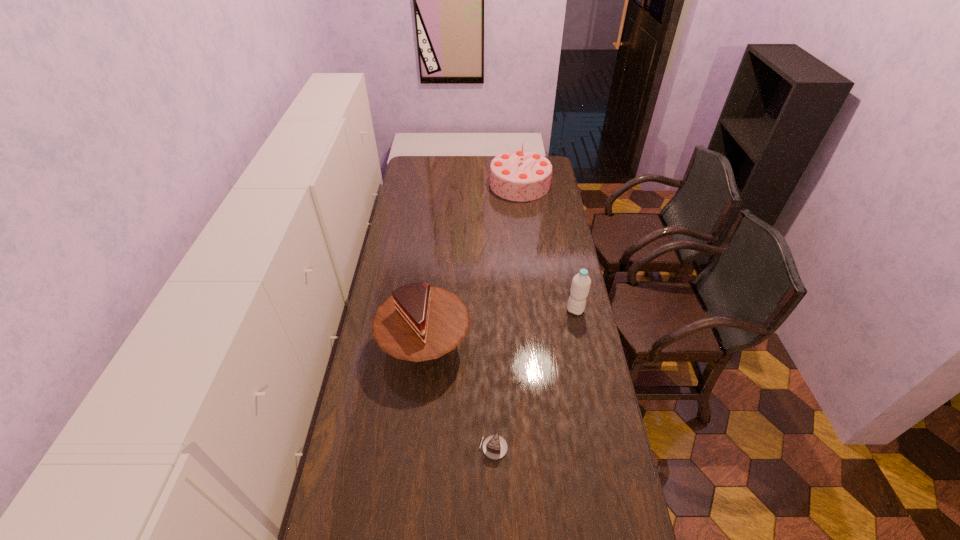
I want to click on object that is at the left edge, so click(418, 322).

This screenshot has height=540, width=960. In order to click on birthday cake positioned at the right edge in this screenshot , I will do `click(519, 175)`.

Where is `water bottle that is at the right edge`? water bottle that is at the right edge is located at coordinates (581, 282).

The height and width of the screenshot is (540, 960). Find the location of `object at the far right corner`. object at the far right corner is located at coordinates (519, 175).

In the image, there is a desktop. Where is `free space at the left edge`? The image size is (960, 540). free space at the left edge is located at coordinates (393, 437).

Find the location of a particular element. The width and height of the screenshot is (960, 540). vacant space at the right edge of the desktop is located at coordinates (564, 431).

In the image, there is a desktop. Identify the location of vacant space at the far left corner. The height and width of the screenshot is (540, 960). tap(424, 174).

Find the location of a particular element. This screenshot has height=540, width=960. vacant region between the shortest object and the farthest object is located at coordinates (507, 316).

Locate an element on the screen. vacant point located between the chocolate cake and the water bottle is located at coordinates (535, 379).

Find the location of a particular element. The width and height of the screenshot is (960, 540). vacant point located between the farthest object and the shortest object is located at coordinates (507, 316).